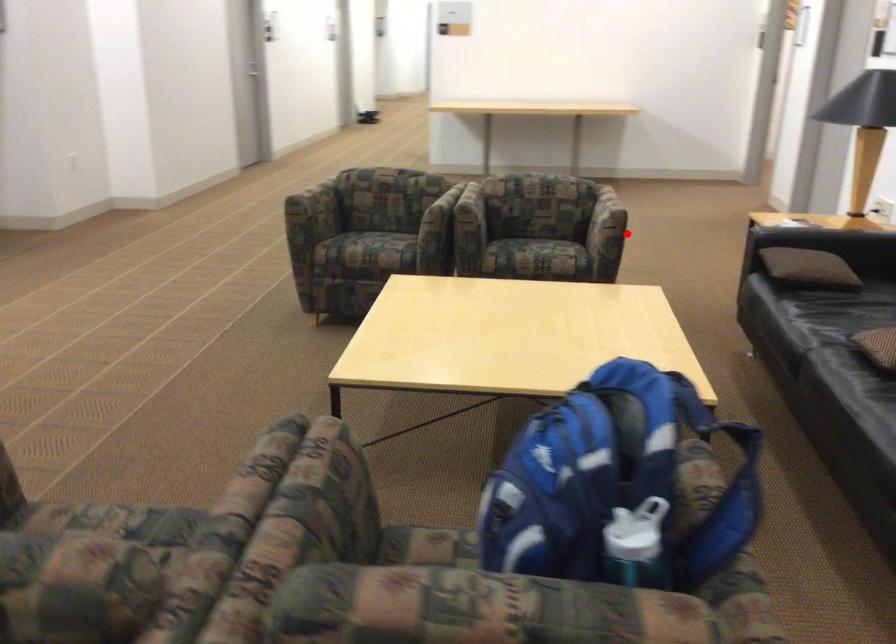
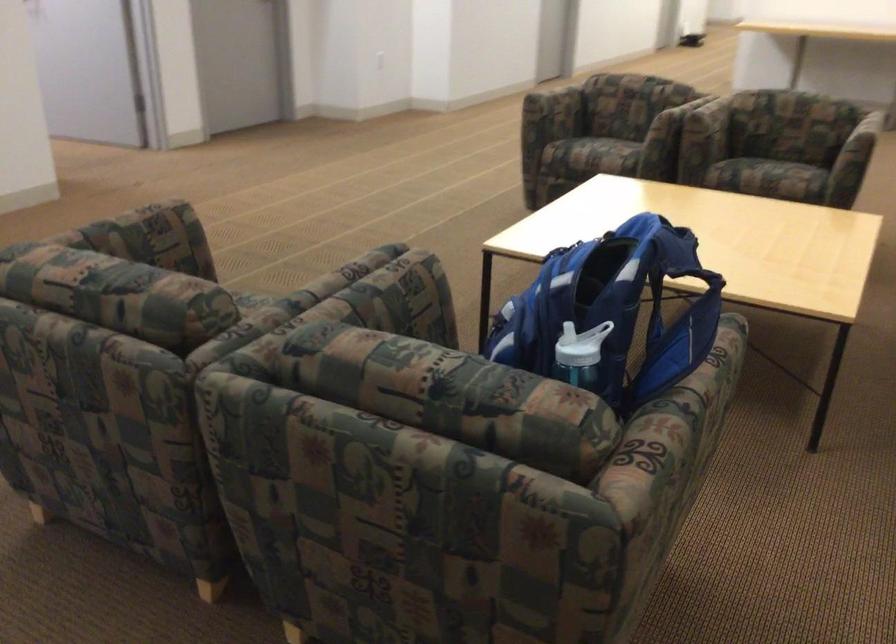
Question: A red point is marked in image1. In image2, is the corresponding 3D point closer to the camera or farther? Reply with the corresponding letter.

Choices:
 (A) The corresponding 3D point is closer.
 (B) The corresponding 3D point is farther.

Answer: (A)